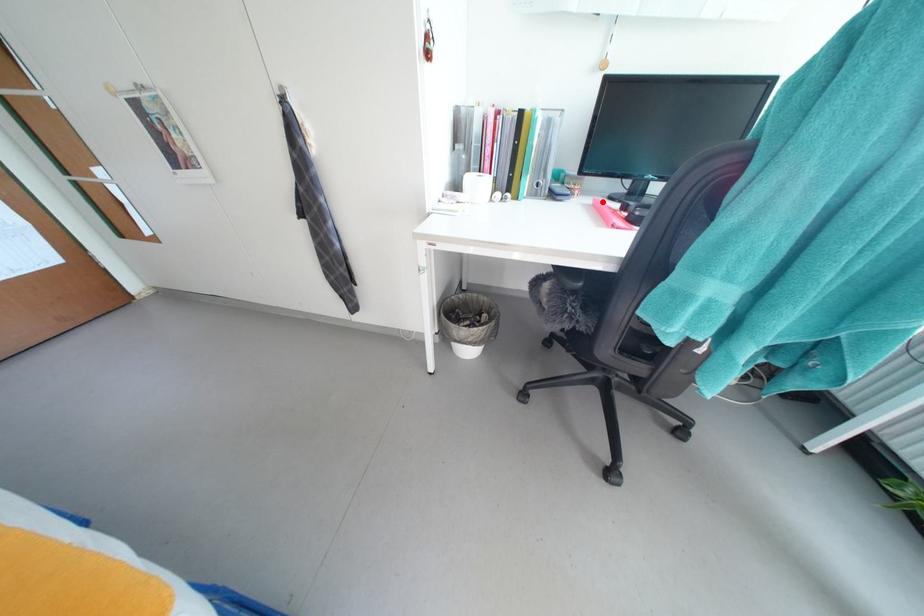
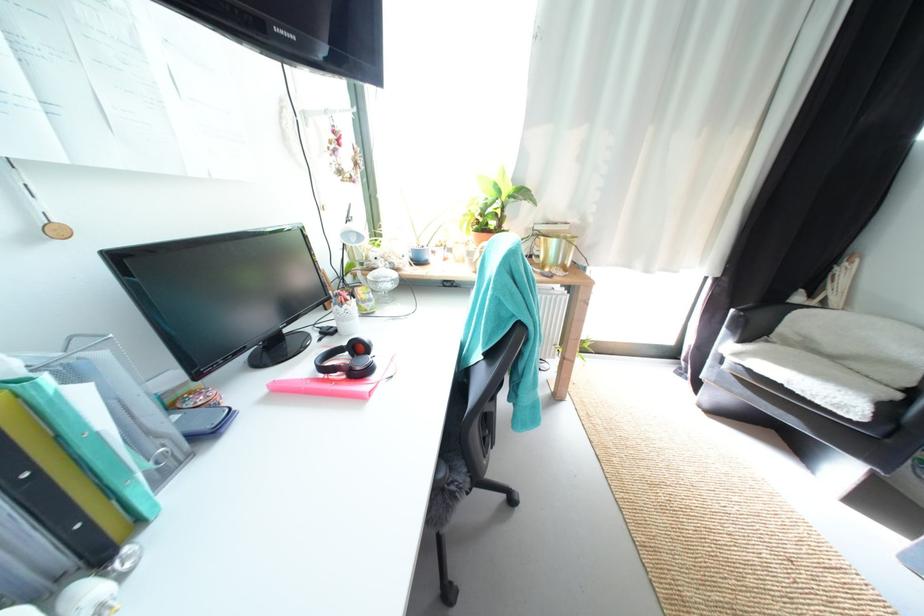
The point at the highlighted location is marked in the first image. Where is the corresponding point in the second image?

(275, 387)